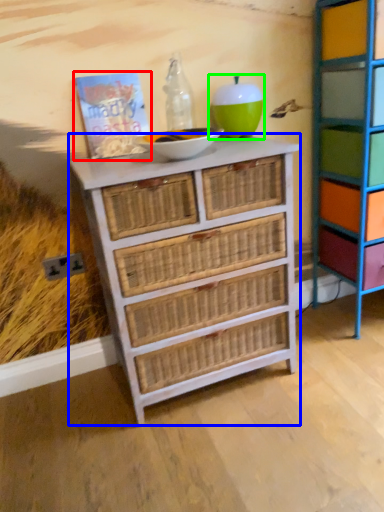
Question: Based on their relative distances, which object is nearer to book (highlighted by a red box)? Choose from chest of drawers (highlighted by a blue box) and turquoise (highlighted by a green box).

Choices:
 (A) chest of drawers
 (B) turquoise

Answer: (B)